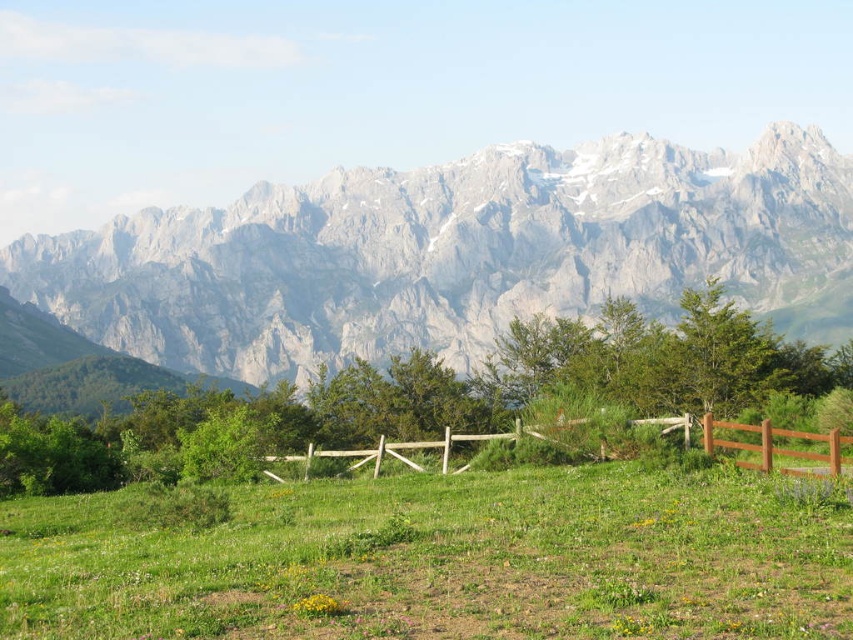
Who is lower down, green grassy pasture at center or brown wooden fence at center?

Positioned lower is green grassy pasture at center.

Who is taller, green grassy pasture at center or brown wooden fence at center?

brown wooden fence at center

Is point (426, 586) positioned before point (833, 452)?

That is True.

The image size is (853, 640). Find the location of `green grassy pasture at center`. green grassy pasture at center is located at coordinates (445, 561).

Does gray rocky mountain range at upper center have a greater height compared to green grassy pasture at center?

Yes, gray rocky mountain range at upper center is taller than green grassy pasture at center.

Between point (74, 266) and point (482, 580), which one is positioned behind?

The point (74, 266) is behind.

In the scene shown: Who is more distant from viewer, [54,285] or [253,637]?

The point [54,285] is behind.

Find the location of a particular element. This screenshot has width=853, height=640. gray rocky mountain range at upper center is located at coordinates (456, 253).

Does gray rocky mountain range at upper center appear on the right side of brown wooden fence at center?

No, gray rocky mountain range at upper center is not to the right of brown wooden fence at center.

Based on the photo, between gray rocky mountain range at upper center and brown wooden fence at center, which one has more height?

With more height is gray rocky mountain range at upper center.

Does point (392, 257) lie in front of point (628, 420)?

No, (392, 257) is behind (628, 420).

You are a GUI agent. You are given a task and a screenshot of the screen. Output one action in this format:
    pyautogui.click(x=<x>, y=<y>)
    Task: Click on the gray rocky mountain range at upper center
    This screenshot has height=640, width=853.
    Given the screenshot: What is the action you would take?
    pyautogui.click(x=456, y=253)